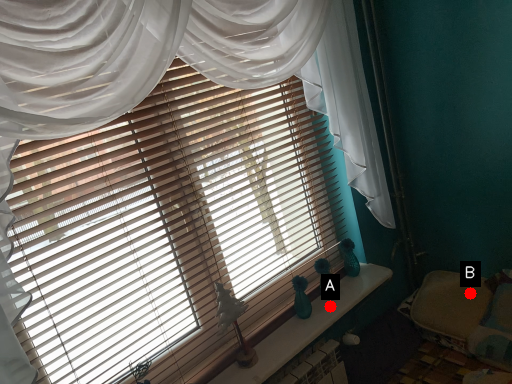
Question: Two points are circled on the image, labeled by A and B beside each circle. Which point is closer to the camera?

Choices:
 (A) A is closer
 (B) B is closer

Answer: (A)